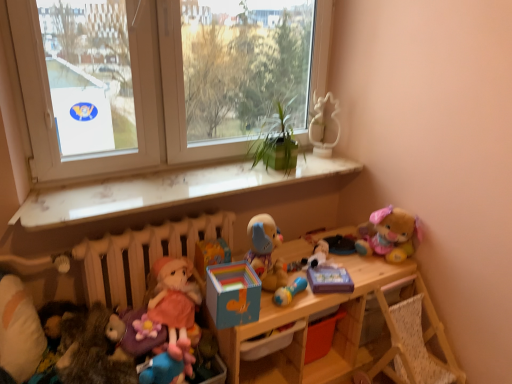
Find the location of a particular element. The image size is (512, 384). vacant location below white paper at upper left, which is the 1th window screen in left-to-right order (from a real-world perspective) is located at coordinates (104, 183).